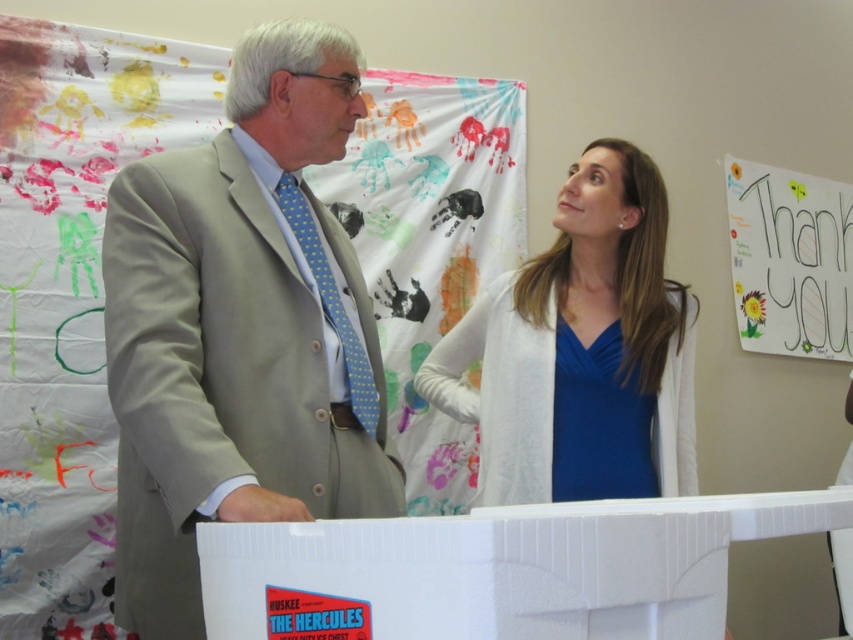
You are an interior designer who needs to place a decorative item exactly at the center of the room. The light beige suit at center is currently occupying that spot. Can you move the decorative item to the same location without overlapping the suit?

The light beige suit at center is already at the center of the room, so you cannot place the decorative item there without overlapping it.

Consider the image. You are a photographer standing 5 feet away from the light beige suit at center. You want to take a closeup shot of the suit without moving closer. Can you do it with a standard zoom lens that has a maximum zoom of 200mm?

The light beige suit at center is 3.57 feet away from the camera. Since you are standing 5 feet away, which is farther than the 3.57 feet distance, you can use the standard zoom lens at 200mm to capture a closeup of the light beige suit at center without moving closer.

You are a tailor measuring two garments for alterations. You have a light beige suit at center and a blue satin blouse at upper center. Which garment has a smaller width?

The light beige suit at center has a smaller width than the blue satin blouse at upper center.